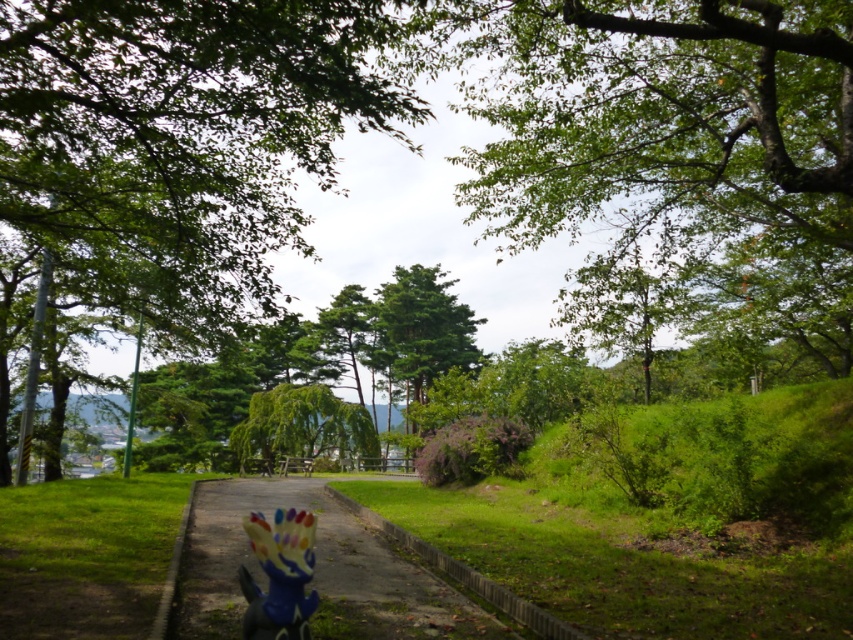
Who is more forward, [283,177] or [229,604]?

Positioned in front is point [229,604].

Does point (270, 131) come in front of point (212, 515)?

Yes, it is.

The image size is (853, 640). What do you see at coordinates (183, 138) in the screenshot?
I see `green leafy tree at center` at bounding box center [183, 138].

The image size is (853, 640). Find the location of `green leafy tree at center`. green leafy tree at center is located at coordinates (183, 138).

How distant is green leafy tree at upper center from dull concrete path at center?

10.89 meters

This screenshot has height=640, width=853. What do you see at coordinates (665, 120) in the screenshot?
I see `green leafy tree at upper center` at bounding box center [665, 120].

Who is more forward, [567,200] or [222,566]?

Positioned in front is point [222,566].

Where is `green leafy tree at upper center`? The height and width of the screenshot is (640, 853). green leafy tree at upper center is located at coordinates (665, 120).

Who is taller, dull concrete path at center or plastic rainbow easter bunny at center?

Standing taller between the two is dull concrete path at center.

From the picture: Can you confirm if dull concrete path at center is shorter than plastic rainbow easter bunny at center?

In fact, dull concrete path at center may be taller than plastic rainbow easter bunny at center.

Which is in front, point (386, 589) or point (306, 612)?

Point (306, 612) is more forward.

The width and height of the screenshot is (853, 640). I want to click on dull concrete path at center, so click(314, 572).